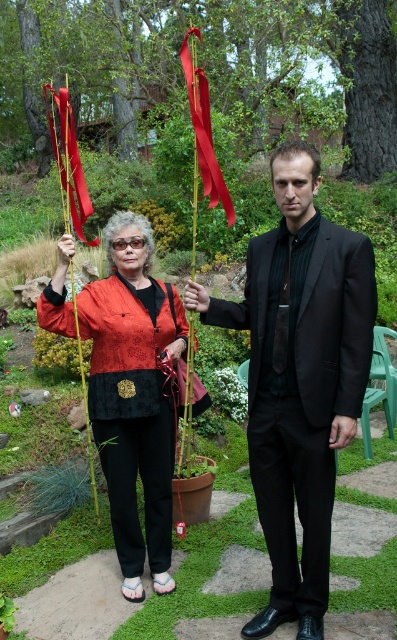
Is point (273, 269) behind point (65, 148)?

No.

Does point (285, 401) lie in front of point (69, 157)?

Yes, it is in front of point (69, 157).

What are the coordinates of `black satin suit at center` in the screenshot? It's located at (300, 378).

You are a GUI agent. You are given a task and a screenshot of the screen. Output one action in this format:
    pyautogui.click(x=<x>, y=<y>)
    Task: Click on the black satin suit at center
    The width and height of the screenshot is (397, 640).
    Given the screenshot: What is the action you would take?
    pyautogui.click(x=300, y=378)

Is silky red ribbon at center thinner than silky red ribbon at left?

Indeed, silky red ribbon at center has a lesser width compared to silky red ribbon at left.

Does point (198, 145) come behind point (80, 170)?

No, (198, 145) is in front of (80, 170).

Where is `silky red ribbon at center`? This screenshot has height=640, width=397. silky red ribbon at center is located at coordinates (204, 128).

Measure the distance from black satin suit at center to silky red ribbon at center.

black satin suit at center is 1.40 meters from silky red ribbon at center.

Is black satin suit at center to the left of silky red ribbon at center from the viewer's perspective?

Incorrect, black satin suit at center is not on the left side of silky red ribbon at center.

Measure the distance between point (279, 536) and camera.

Point (279, 536) and camera are 3.25 meters apart.

This screenshot has height=640, width=397. I want to click on black satin suit at center, so click(x=300, y=378).